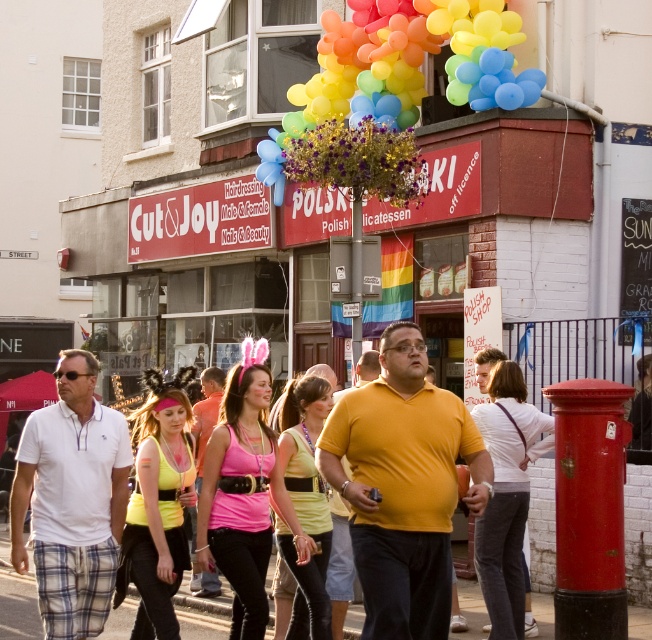
Which is below, neon yellow fabric at center or white jersey at center?

white jersey at center

Does neon yellow fabric at center appear on the right side of white jersey at center?

No, neon yellow fabric at center is not to the right of white jersey at center.

What are the coordinates of `neon yellow fabric at center` in the screenshot? It's located at (156, 506).

Locate an element on the screen. The width and height of the screenshot is (652, 640). neon yellow fabric at center is located at coordinates (156, 506).

Which is in front, point (447, 456) or point (216, 579)?

Point (447, 456) is in front.

The image size is (652, 640). What do you see at coordinates (402, 486) in the screenshot?
I see `yellow matte shirt at center` at bounding box center [402, 486].

Find the location of `yellow matte shirt at center`. yellow matte shirt at center is located at coordinates (402, 486).

Does point (164, 531) come closer to viewer compared to point (192, 404)?

Yes, point (164, 531) is closer to viewer.

Which is in front, point (156, 570) or point (201, 371)?

Point (156, 570) is more forward.

What do you see at coordinates (156, 506) in the screenshot? This screenshot has width=652, height=640. I see `neon yellow fabric at center` at bounding box center [156, 506].

Locate an element on the screen. This screenshot has width=652, height=640. neon yellow fabric at center is located at coordinates (156, 506).